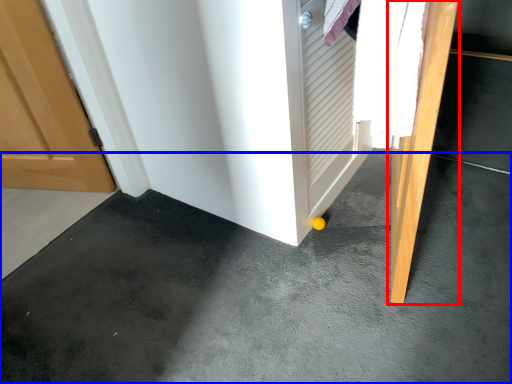
Question: Which object appears closest to the camera in this image, door (highlighted by a red box) or concrete (highlighted by a blue box)?

Choices:
 (A) door
 (B) concrete

Answer: (B)